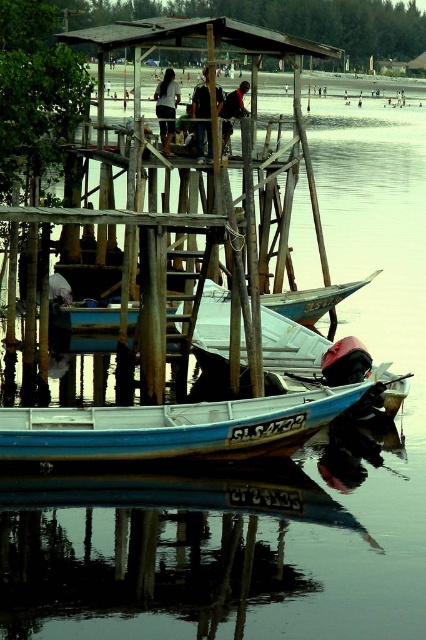
What do you see at coordinates (166, 108) in the screenshot?
I see `dark blue jeans at center` at bounding box center [166, 108].

Which is behind, point (173, 125) or point (219, 102)?

The point (219, 102) is behind.

Between point (158, 102) and point (199, 100), which one is positioned in front?

Point (199, 100) is in front.

The height and width of the screenshot is (640, 426). I want to click on dark blue jeans at center, so click(166, 108).

Who is higher up, wooden canoe at center or dark blue shirt at center?

dark blue shirt at center is above.

Where is `wooden canoe at center`? This screenshot has width=426, height=640. wooden canoe at center is located at coordinates (176, 426).

The image size is (426, 640). Find the location of `wooden canoe at center`. wooden canoe at center is located at coordinates (176, 426).

Is wooden canoe at center to the right of dark brown leather jacket at upper center from the viewer's perspective?

Incorrect, wooden canoe at center is not on the right side of dark brown leather jacket at upper center.

Does wooden canoe at center lie behind dark brown leather jacket at upper center?

No.

Who is more distant from viewer, (34,458) or (232,108)?

The point (232,108) is more distant.

You are a GUI agent. You are given a task and a screenshot of the screen. Output one action in this format:
    pyautogui.click(x=<x>, y=<y>)
    Task: Click on the wooden canoe at center
    
    Given the screenshot: What is the action you would take?
    pyautogui.click(x=176, y=426)